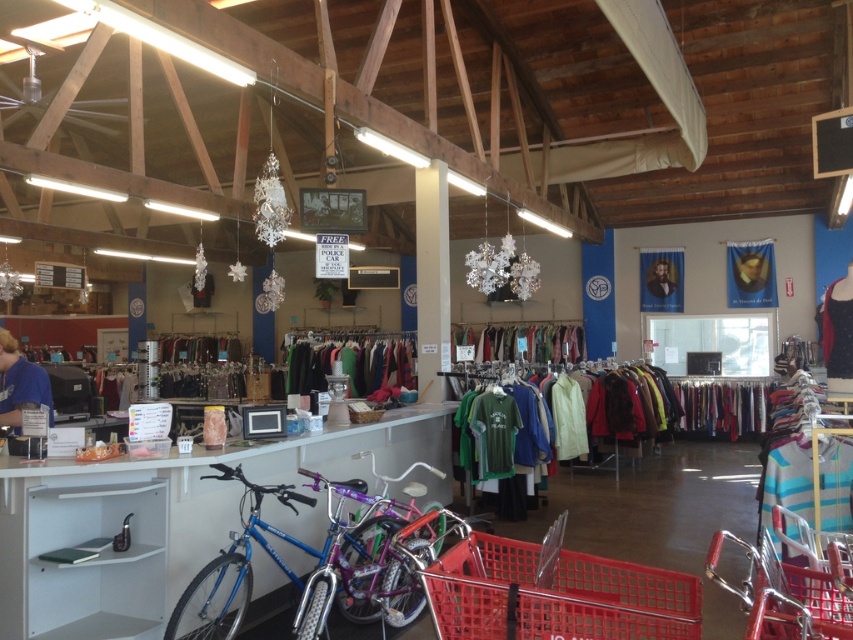
Question: Considering the relative positions of white matte shelf at lower left and black jersey at right in the image provided, where is white matte shelf at lower left located with respect to black jersey at right?

Choices:
 (A) left
 (B) right

Answer: (A)

Question: Is purple metallic bicycle at lower left bigger than smooth plastic poster at center?

Choices:
 (A) no
 (B) yes

Answer: (B)

Question: Can you confirm if purple metallic bicycle at lower left is positioned below green fabric dress at center?

Choices:
 (A) no
 (B) yes

Answer: (B)

Question: Which point is closer to the camera taking this photo?

Choices:
 (A) (125, 580)
 (B) (18, 353)

Answer: (A)

Question: Which point is farther from the camera taking this photo?

Choices:
 (A) (834, 308)
 (B) (376, 614)
 (C) (386, 536)
 (D) (9, 417)

Answer: (B)

Question: Which point is closer to the camera?

Choices:
 (A) black jersey at right
 (B) green fabric dress at center
 (C) shiny blue bicycle at center

Answer: (C)